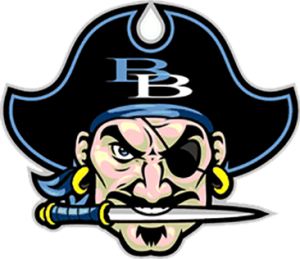
Locate an element on the screen. The height and width of the screenshot is (259, 300). knife handle is located at coordinates (75, 214).